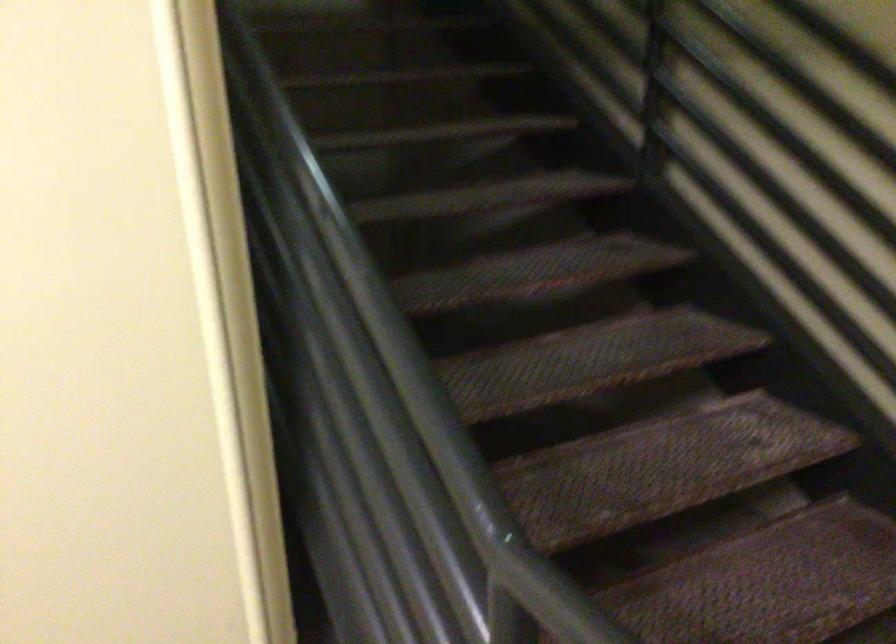
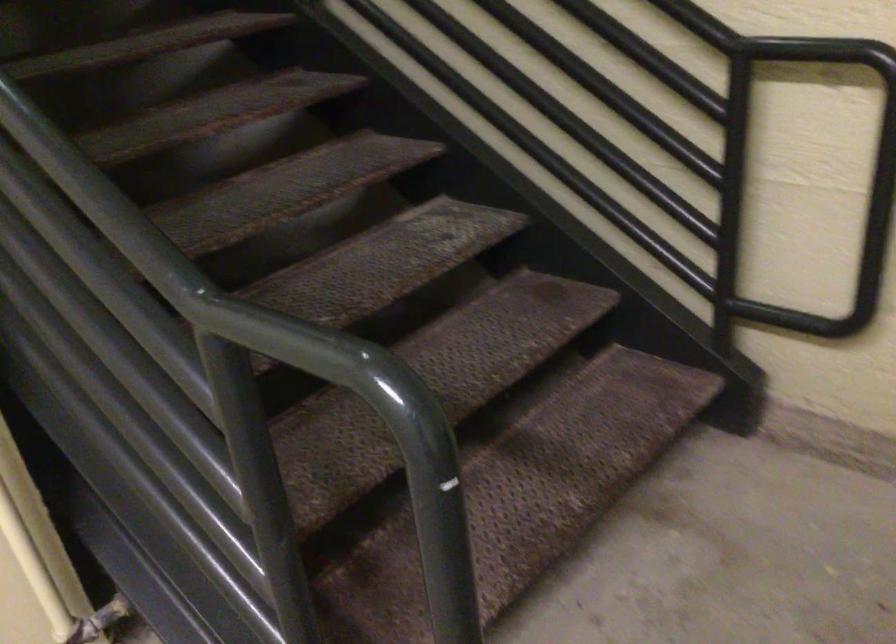
In a continuous first-person perspective shot, in which direction is the camera moving?

The cameraman moved toward right, backward.